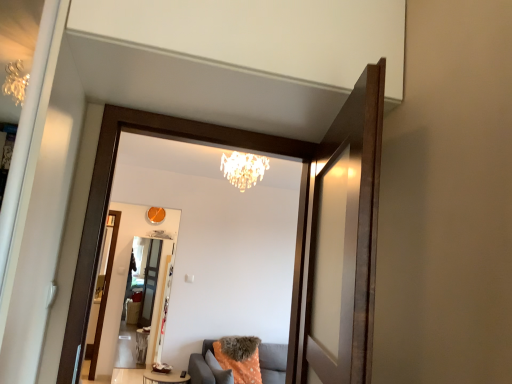
The width and height of the screenshot is (512, 384). Describe the element at coordinates (164, 377) in the screenshot. I see `wooden round table at center` at that location.

This screenshot has width=512, height=384. What are the coordinates of `matte wooden mirror at center` in the screenshot? It's located at (207, 243).

The width and height of the screenshot is (512, 384). What do you see at coordinates (207, 243) in the screenshot? I see `matte wooden mirror at center` at bounding box center [207, 243].

Locate an element on the screen. Image resolution: width=512 pixels, height=384 pixels. wooden round table at center is located at coordinates (164, 377).

What's the angular difference between clear glass screen door at center, the 1th screen door in the bottom-to-top sequence, and crystal chandelier at upper center's facing directions?

The angle between the facing direction of clear glass screen door at center, the 1th screen door in the bottom-to-top sequence, and the facing direction of crystal chandelier at upper center is 2.53 degrees.

Is clear glass screen door at center, which is the second screen door in top-to-bottom order, thinner than crystal chandelier at upper center?

Correct, the width of clear glass screen door at center, which is the second screen door in top-to-bottom order, is less than that of crystal chandelier at upper center.

Where is `light fixture on the right of the clear glass screen door at center, the 1th screen door in the bottom-to-top sequence`? light fixture on the right of the clear glass screen door at center, the 1th screen door in the bottom-to-top sequence is located at coordinates (243, 169).

From the image's perspective, would you say clear glass screen door at center, which is the second screen door in top-to-bottom order, is positioned over crystal chandelier at upper center?

No, from the image's perspective, clear glass screen door at center, which is the second screen door in top-to-bottom order, is not on top of crystal chandelier at upper center.

Can you confirm if matte wooden mirror at center is positioned to the right of wooden round table at center?

Indeed, matte wooden mirror at center is positioned on the right side of wooden round table at center.

Is there a large distance between matte wooden mirror at center and wooden round table at center?

matte wooden mirror at center is positioned a significant distance from wooden round table at center.

Considering the sizes of objects matte wooden mirror at center and wooden round table at center in the image provided, who is smaller, matte wooden mirror at center or wooden round table at center?

wooden round table at center is smaller.

Could wooden round table at center be considered to be inside matte wooden mirror at center?

No.

Can you tell me how much transparent glass screen door at upper center, placed as the first screen door when sorted from top to bottom, and crystal chandelier at upper center differ in facing direction?

transparent glass screen door at upper center, placed as the first screen door when sorted from top to bottom, and crystal chandelier at upper center are facing 108 degrees away from each other.

Are transparent glass screen door at upper center, which is the first screen door in front-to-back order, and crystal chandelier at upper center making contact?

No, transparent glass screen door at upper center, which is the first screen door in front-to-back order, is not next to crystal chandelier at upper center.

From a real-world perspective, which is physically above, transparent glass screen door at upper center, which is the first screen door in front-to-back order, or crystal chandelier at upper center?

crystal chandelier at upper center is physically above.

Is transparent glass screen door at upper center, which is counted as the first screen door, starting from the right, oriented towards crystal chandelier at upper center?

No, transparent glass screen door at upper center, which is counted as the first screen door, starting from the right, is not turned towards crystal chandelier at upper center.

Consider the image. Who is more distant, wooden round table at center or matte wooden mirror at center?

wooden round table at center is further away from the camera.

Is point (157, 374) closer to camera compared to point (149, 223)?

Yes, point (157, 374) is in front of point (149, 223).

From a real-world perspective, which object rests below the other?

wooden round table at center.

Is matte wooden mirror at center surrounded by wooden round table at center?

No, matte wooden mirror at center is located outside of wooden round table at center.

Considering the positions of point (203, 234) and point (157, 263), is point (203, 234) closer or farther from the camera than point (157, 263)?

Point (203, 234).

Is matte wooden mirror at center turned away from clear glass screen door at center, the second screen door in the front-to-back sequence?

Yes.

Based on the photo, in the image, is matte wooden mirror at center on the left side or the right side of clear glass screen door at center, the 1th screen door in the bottom-to-top sequence?

From the image, it's evident that matte wooden mirror at center is to the right of clear glass screen door at center, the 1th screen door in the bottom-to-top sequence.

Which is behind, point (239, 162) or point (270, 250)?

The point (270, 250) is more distant.

Is crystal chandelier at upper center in front of matte wooden mirror at center?

No, crystal chandelier at upper center is behind matte wooden mirror at center.

From a real-world perspective, is crystal chandelier at upper center positioned over matte wooden mirror at center based on gravity?

Yes, from a real-world perspective, crystal chandelier at upper center is on top of matte wooden mirror at center.

Which object is positioned more to the right, wooden round table at center or crystal chandelier at upper center?

From the viewer's perspective, crystal chandelier at upper center appears more on the right side.

Is wooden round table at center positioned before crystal chandelier at upper center?

That is False.

What are the coordinates of `table on the left of crystal chandelier at upper center` in the screenshot? It's located at (x=164, y=377).

I want to click on light fixture that is in front of the clear glass screen door at center, the 1th screen door when ordered from back to front, so click(243, 169).

In order to click on table below the matte wooden mirror at center (from a real-world perspective) in this screenshot , I will do `click(164, 377)`.

Based on their spatial positions, is transparent glass screen door at upper center, acting as the 2th screen door starting from the bottom, or crystal chandelier at upper center further from matte wooden mirror at center?

Among the two, transparent glass screen door at upper center, acting as the 2th screen door starting from the bottom, is located further to matte wooden mirror at center.

From the image, which object appears to be nearer to wooden round table at center, transparent glass screen door at upper center, which is the second screen door from back to front, or crystal chandelier at upper center?

crystal chandelier at upper center is positioned closer to the anchor wooden round table at center.

From the image, which object appears to be nearer to crystal chandelier at upper center, transparent glass screen door at upper center, placed as the first screen door when sorted from top to bottom, or wooden round table at center?

transparent glass screen door at upper center, placed as the first screen door when sorted from top to bottom, is positioned closer to the anchor crystal chandelier at upper center.

Estimate the real-world distances between objects in this image. Which object is closer to transparent glass screen door at upper center, which is counted as the first screen door, starting from the right, clear glass screen door at center, the 1th screen door in the bottom-to-top sequence, or matte wooden mirror at center?

Among the two, matte wooden mirror at center is located nearer to transparent glass screen door at upper center, which is counted as the first screen door, starting from the right.

Looking at this image, estimate the real-world distances between objects in this image. Which object is further from wooden round table at center, clear glass screen door at center, the second screen door in the front-to-back sequence, or crystal chandelier at upper center?

The object further to wooden round table at center is crystal chandelier at upper center.

Based on their spatial positions, is wooden round table at center or matte wooden mirror at center closer to transparent glass screen door at upper center, placed as the first screen door when sorted from top to bottom?

Among the two, matte wooden mirror at center is located nearer to transparent glass screen door at upper center, placed as the first screen door when sorted from top to bottom.

Considering their positions, is clear glass screen door at center, the second screen door in the front-to-back sequence, positioned closer to wooden round table at center than transparent glass screen door at upper center, placed as the first screen door when sorted from top to bottom?

Based on the image, clear glass screen door at center, the second screen door in the front-to-back sequence, appears to be nearer to wooden round table at center.

From the image, which object appears to be farther from wooden round table at center, crystal chandelier at upper center or matte wooden mirror at center?

Among the two, crystal chandelier at upper center is located further to wooden round table at center.

The width and height of the screenshot is (512, 384). I want to click on table between crystal chandelier at upper center and clear glass screen door at center, the 1th screen door from the left, along the z-axis, so click(x=164, y=377).

Where is `mirror located between transparent glass screen door at upper center, which appears as the second screen door when viewed from the left, and clear glass screen door at center, the 1th screen door in the bottom-to-top sequence, in the depth direction`? mirror located between transparent glass screen door at upper center, which appears as the second screen door when viewed from the left, and clear glass screen door at center, the 1th screen door in the bottom-to-top sequence, in the depth direction is located at coordinates (207, 243).

I want to click on table between matte wooden mirror at center and clear glass screen door at center, placed as the second screen door when sorted from right to left, from front to back, so click(164, 377).

Identify the location of table between transparent glass screen door at upper center, acting as the 2th screen door starting from the bottom, and clear glass screen door at center, the 1th screen door from the left, in the front-back direction. Image resolution: width=512 pixels, height=384 pixels. (164, 377).